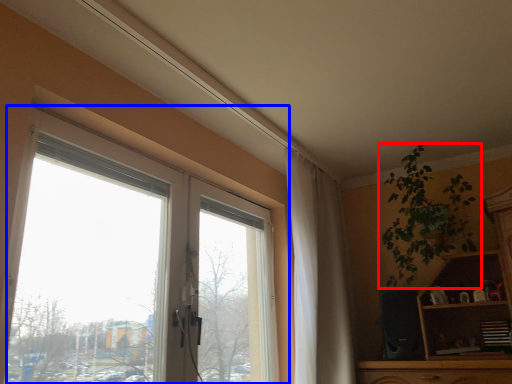
Question: Which point is closer to the camera, houseplant (highlighted by a red box) or window (highlighted by a blue box)?

Choices:
 (A) houseplant
 (B) window

Answer: (B)